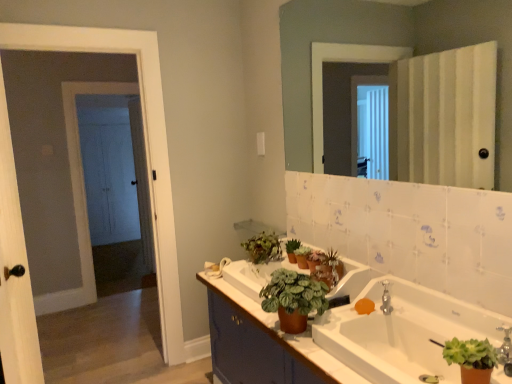
Where is `free space to the right of orange matte soap at sink`? This screenshot has width=512, height=384. free space to the right of orange matte soap at sink is located at coordinates (402, 325).